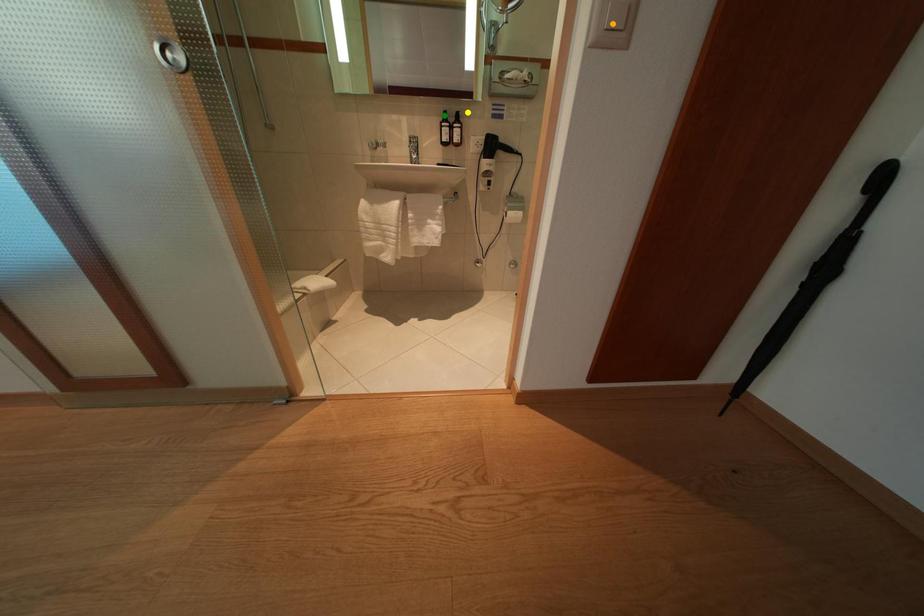
Order these from farthest to nearest:
yellow point, green point, orange point

1. green point
2. yellow point
3. orange point